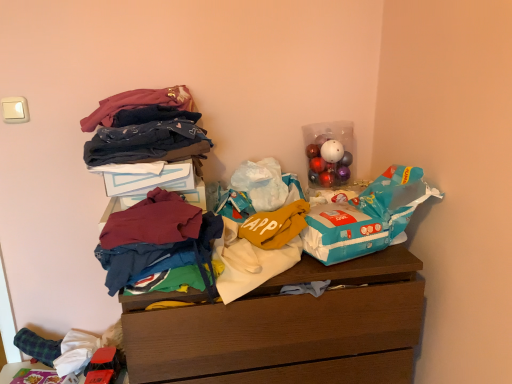
Question: Based on their positions, is wooden chest of drawers at center located to the left or right of maroon fabric shirt at center, marked as the 2th clothing in a bottom-to-top arrangement?

Choices:
 (A) left
 (B) right

Answer: (B)

Question: Relative to maroon fabric shirt at center, the third clothing from the top, is wooden chest of drawers at center in front or behind?

Choices:
 (A) behind
 (B) front

Answer: (A)

Question: Which object is positioned farthest from the velvet-like fabric at upper left, positioned as the first clothing in top-to-bottom order?

Choices:
 (A) maroon cotton t-shirt at center, arranged as the 1th clothing when ordered from the bottom
 (B) maroon fabric shirt at center, the third clothing from the top
 (C) wooden chest of drawers at center
 (D) blue cotton blanket at upper left, which appears as the third clothing when ordered from the bottom
 (E) blue plastic grocery bag at upper right

Answer: (C)

Question: Estimate the real-world distances between objects in this image. Which object is closer to the maroon fabric shirt at center, marked as the 2th clothing in a bottom-to-top arrangement?

Choices:
 (A) wooden chest of drawers at center
 (B) shiny plastic ornaments at upper right
 (C) velvet-like fabric at upper left, positioned as the first clothing in top-to-bottom order
 (D) blue cotton blanket at upper left, which appears as the 2th clothing when viewed from the top
 (E) blue plastic grocery bag at upper right

Answer: (D)